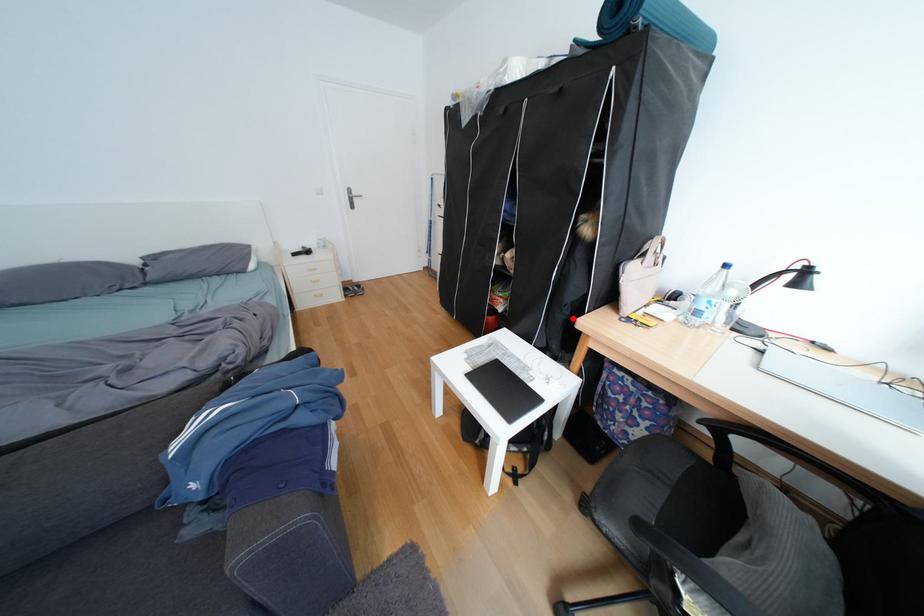
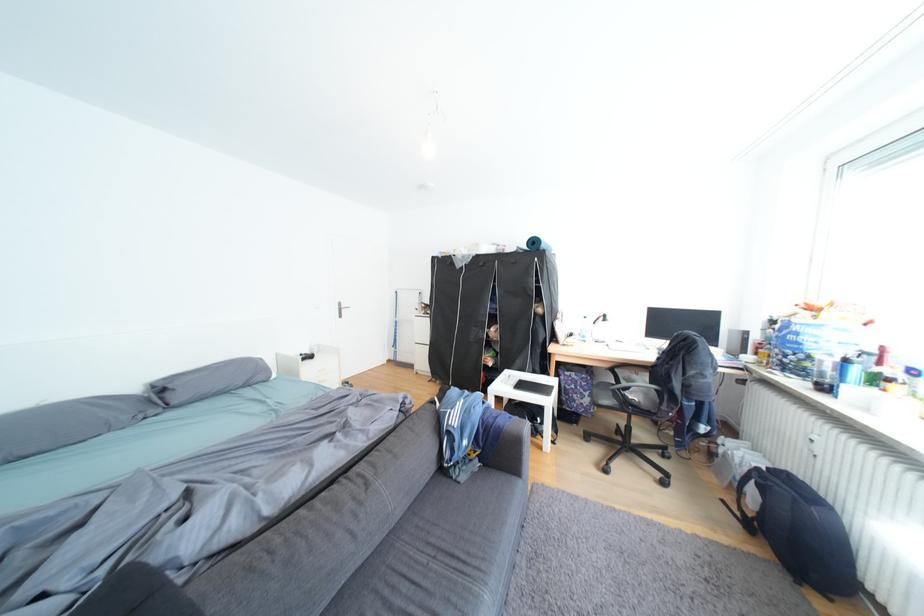
Question: I am providing you with two images of the same scene from different viewpoints. A red point is marked on the first image. At the location where the point appears in image 1, is it still visible in image 2?

Choices:
 (A) Yes
 (B) No

Answer: (A)